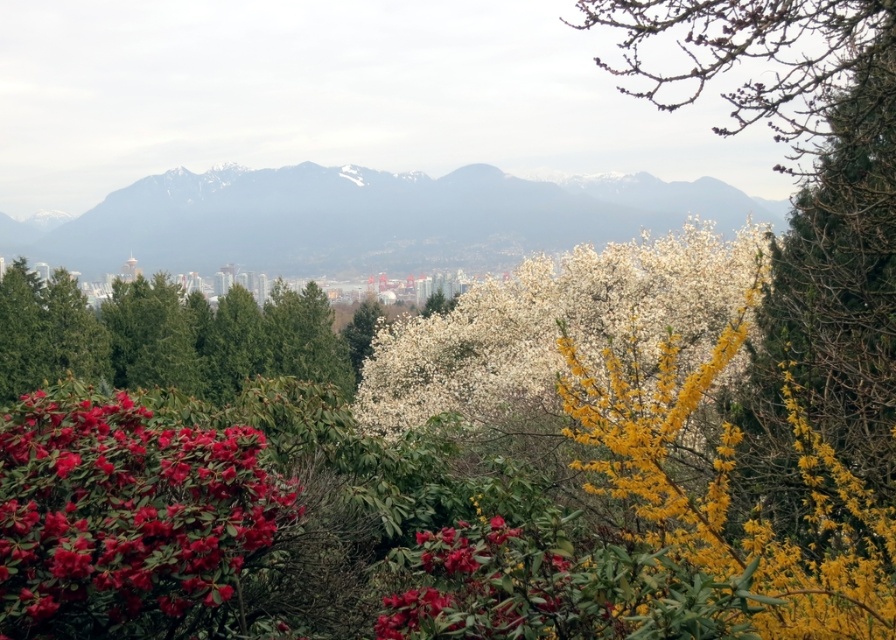
Is the position of snowy mountain range at upper center less distant than that of matte red flowers at lower left?

No, snowy mountain range at upper center is further to the viewer.

Does snowy mountain range at upper center have a smaller size compared to matte red flowers at lower left?

Incorrect, snowy mountain range at upper center is not smaller in size than matte red flowers at lower left.

Locate an element on the screen. The width and height of the screenshot is (896, 640). snowy mountain range at upper center is located at coordinates (366, 220).

Locate an element on the screen. The image size is (896, 640). snowy mountain range at upper center is located at coordinates (366, 220).

Who is positioned more to the right, matte red flowers at lower left or green matte tree at left?

From the viewer's perspective, matte red flowers at lower left appears more on the right side.

Is matte red flowers at lower left behind green matte tree at left?

No.

Does point (187, 545) come farther from viewer compared to point (30, 349)?

No, it is not.

Where is `matte red flowers at lower left`? matte red flowers at lower left is located at coordinates (125, 516).

Does point (7, 360) come farther from viewer compared to point (416, 609)?

Yes, it is behind point (416, 609).

Who is positioned more to the right, green matte tree at left or matte red flower at lower left?

Positioned to the right is matte red flower at lower left.

Between point (190, 314) and point (450, 602), which one is positioned in front?

Point (450, 602)

This screenshot has height=640, width=896. What are the coordinates of `green matte tree at left` in the screenshot? It's located at (162, 337).